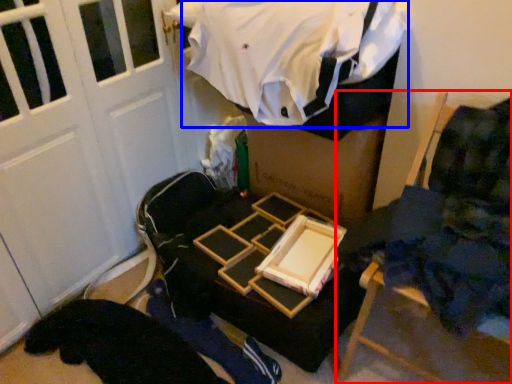
Question: Which point is further to the camera, furniture (highlighted by a red box) or clothing (highlighted by a blue box)?

Choices:
 (A) furniture
 (B) clothing

Answer: (B)